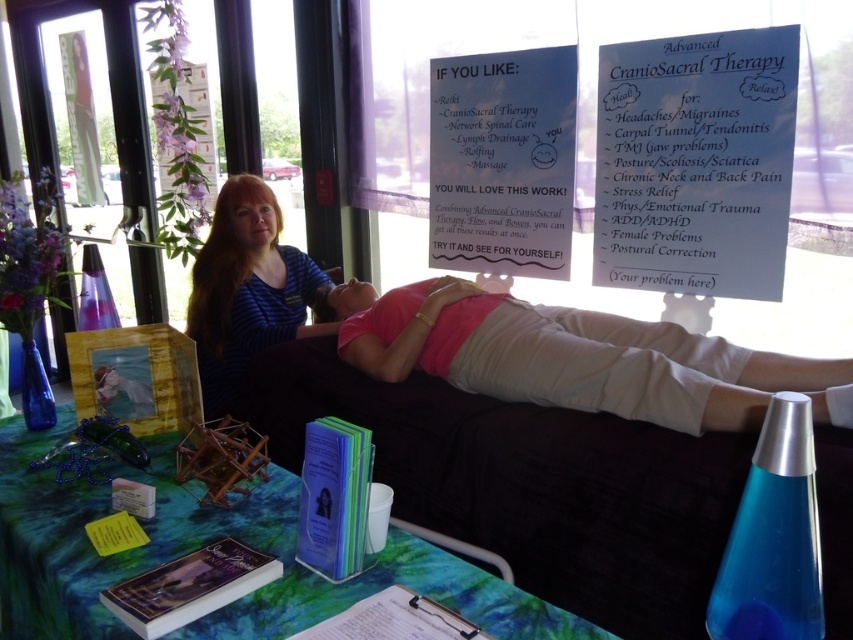
You are standing at the entrance of the event and want to read the white paper sign at upper right. Is the sign within your immediate line of sight without needing to move closer?

The white paper sign at upper right is 6.08 feet from viewer, so yes, it is within immediate line of sight without needing to move closer.

You are at the Advanced CranioSacral Therapy booth and want to pick up an item located at point (653, 129) and another item at point (222, 406). Which item will you reach first if you move straight towards the table?

You will reach the item at point (653, 129) first because it is closer to you than the item at point (222, 406).

You are at a health fair and see a table with a green tie dye tablecloth. On the table, there is a blue lava lamp and a point marked at coordinates (695, 163). Where is the point located relative to the white paper sign at upper right?

The point at (695, 163) is located on the white paper sign at upper right.